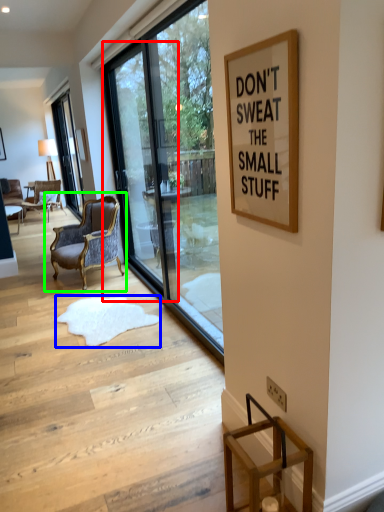
Question: Considering the real-world distances, which object is farthest from screen door (highlighted by a red box)? doormat (highlighted by a blue box) or chair (highlighted by a green box)?

Choices:
 (A) doormat
 (B) chair

Answer: (A)